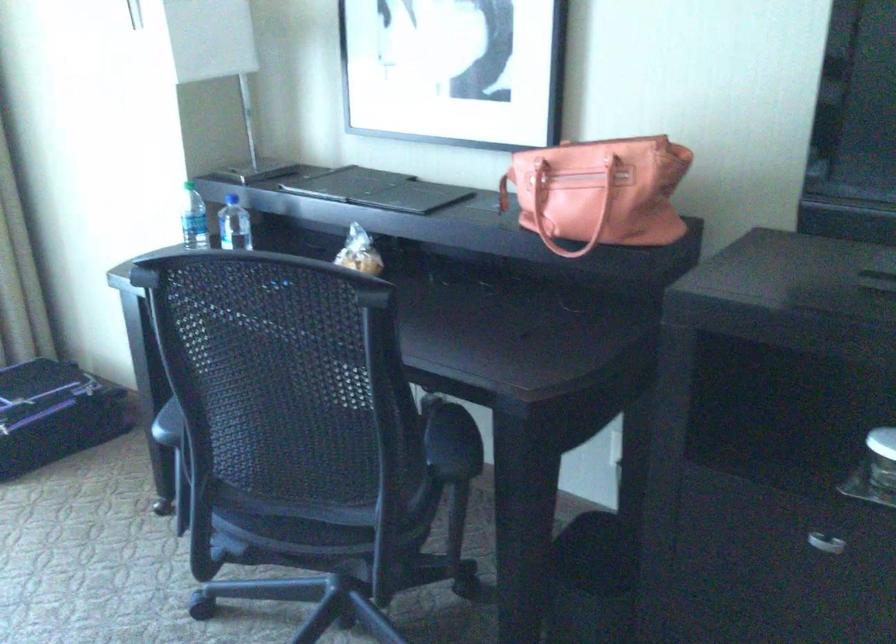
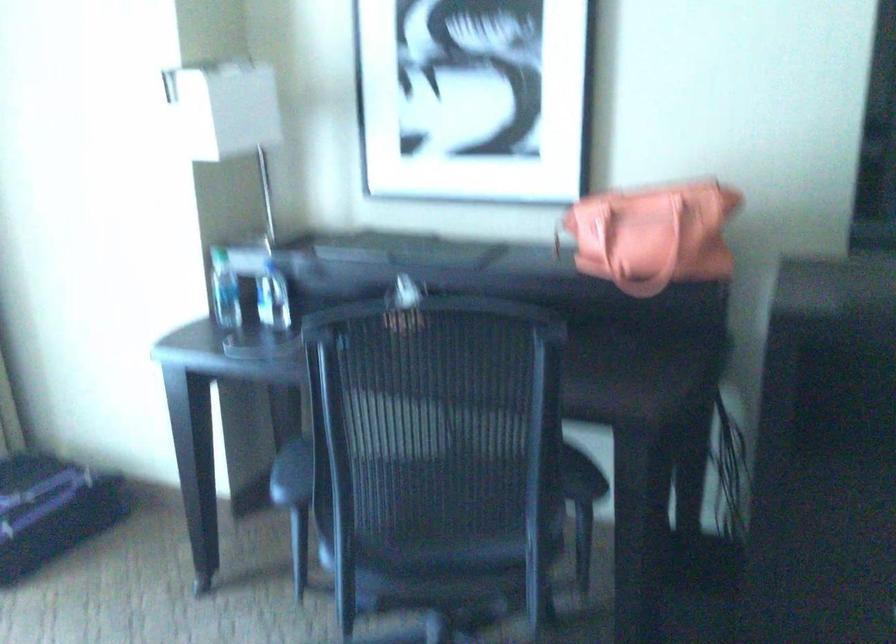
In the second image, find the point that corresponds to [228,236] in the first image.

(271, 299)